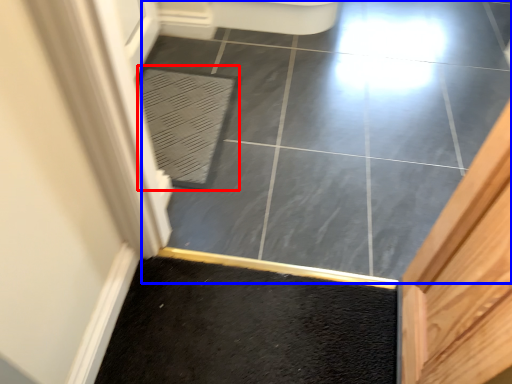
Question: Which of the following is the farthest to the observer, bath mat (highlighted by a red box) or ceramic tile (highlighted by a blue box)?

Choices:
 (A) bath mat
 (B) ceramic tile

Answer: (A)